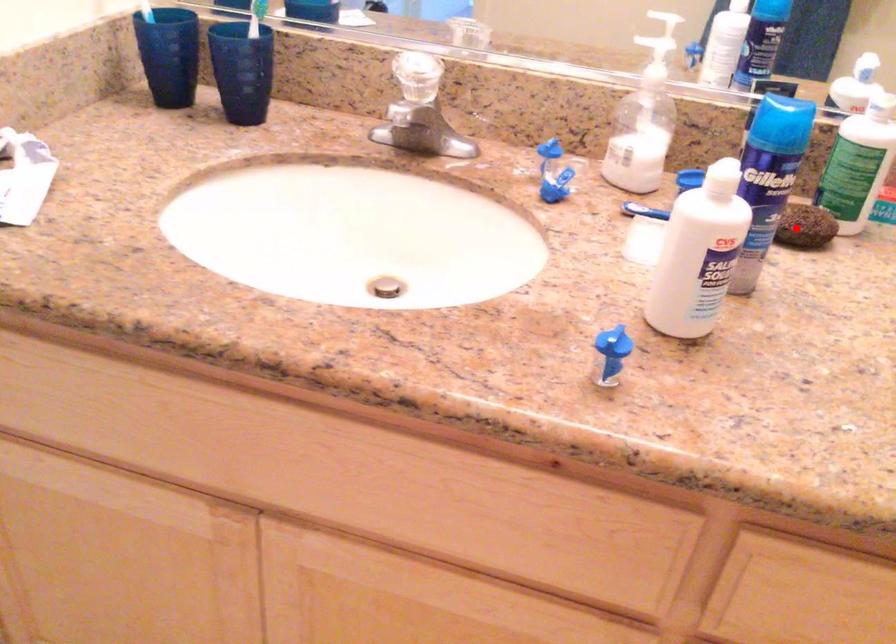
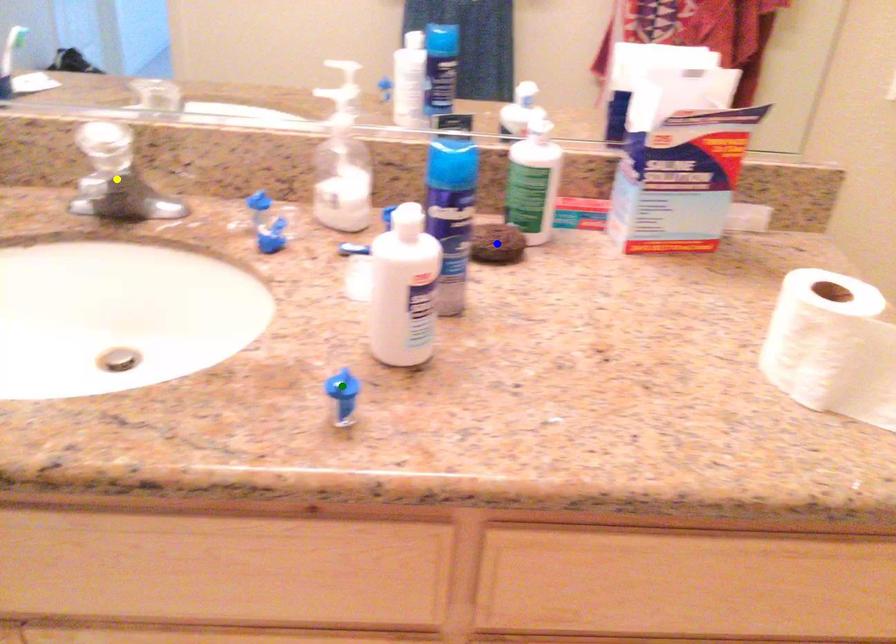
Question: I am providing you with two images of the same scene from different viewpoints. A red point is marked on the first image. You are given multiple points on the second image. Can you choose the point in image 2 that corresponds to the point in image 1?

Choices:
 (A) blue point
 (B) yellow point
 (C) green point

Answer: (A)